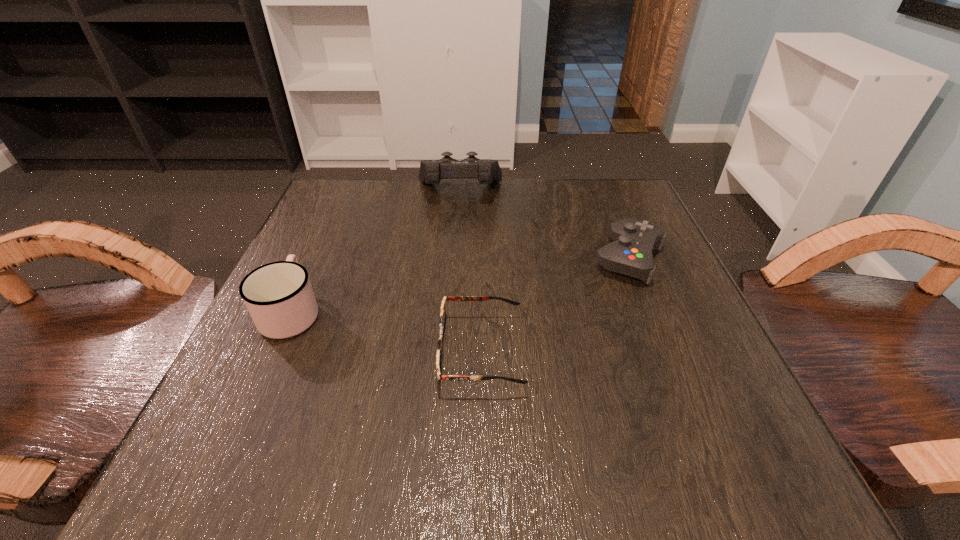
Identify the location of vacant area at the right edge. Image resolution: width=960 pixels, height=540 pixels. (677, 396).

Locate an element on the screen. The image size is (960, 540). free location at the far left corner is located at coordinates point(345,210).

The width and height of the screenshot is (960, 540). Identify the location of free spot at the near left corner of the desktop. (278, 452).

In the image, there is a desktop. What are the coordinates of `free space at the far right corner` in the screenshot? It's located at (616, 209).

Locate an element on the screen. This screenshot has height=540, width=960. vacant area at the near right corner is located at coordinates (767, 487).

Image resolution: width=960 pixels, height=540 pixels. Identify the location of empty location between the farthest object and the shorter control. (544, 225).

At what (x,y) coordinates should I click in order to perform the action: click on blank region between the right control and the leftmost object. Please return your answer as a coordinate pair (x, y). Image resolution: width=960 pixels, height=540 pixels. Looking at the image, I should click on (461, 285).

Find the location of a particular element. The height and width of the screenshot is (540, 960). empty location between the left control and the spectacles is located at coordinates (470, 272).

This screenshot has width=960, height=540. Find the location of `vacant space that is in between the right control and the shortest object`. vacant space that is in between the right control and the shortest object is located at coordinates tap(555, 305).

The width and height of the screenshot is (960, 540). I want to click on vacant space that is in between the farthest object and the shortest object, so click(x=470, y=272).